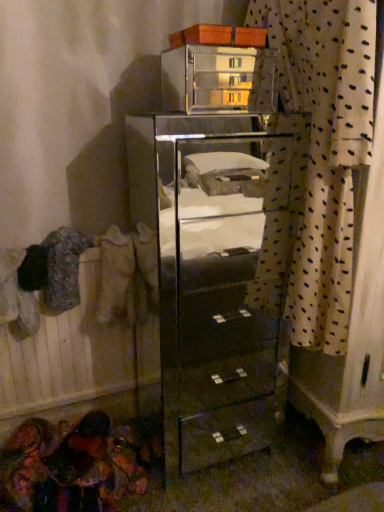
Question: Does white dotted fabric at right have a larger size compared to clear glass cabinet at center?

Choices:
 (A) yes
 (B) no

Answer: (B)

Question: Considering the relative sizes of white dotted fabric at right and clear glass cabinet at center in the image provided, is white dotted fabric at right smaller than clear glass cabinet at center?

Choices:
 (A) no
 (B) yes

Answer: (B)

Question: Can you confirm if white dotted fabric at right is thinner than clear glass cabinet at center?

Choices:
 (A) yes
 (B) no

Answer: (A)

Question: From a real-world perspective, is white dotted fabric at right on top of clear glass cabinet at center?

Choices:
 (A) no
 (B) yes

Answer: (B)

Question: Would you say white dotted fabric at right is a long distance from clear glass cabinet at center?

Choices:
 (A) yes
 (B) no

Answer: (B)

Question: Looking at their shapes, would you say beige fabric at left is wider or thinner than white dotted fabric at right?

Choices:
 (A) wide
 (B) thin

Answer: (A)

Question: In the image, is beige fabric at left positioned in front of or behind white dotted fabric at right?

Choices:
 (A) front
 (B) behind

Answer: (B)

Question: Do you think beige fabric at left is within white dotted fabric at right, or outside of it?

Choices:
 (A) outside
 (B) inside

Answer: (A)

Question: From their relative heights in the image, would you say beige fabric at left is taller or shorter than white dotted fabric at right?

Choices:
 (A) short
 (B) tall

Answer: (A)

Question: Looking at their shapes, would you say white dotted fabric at right is wider or thinner than beige fabric at left?

Choices:
 (A) thin
 (B) wide

Answer: (A)

Question: Does point (340, 173) appear closer or farther from the camera than point (109, 246)?

Choices:
 (A) farther
 (B) closer

Answer: (B)

Question: Considering the positions of white dotted fabric at right and beige fabric at left in the image, is white dotted fabric at right bigger or smaller than beige fabric at left?

Choices:
 (A) small
 (B) big

Answer: (B)

Question: From their relative heights in the image, would you say white dotted fabric at right is taller or shorter than beige fabric at left?

Choices:
 (A) short
 (B) tall

Answer: (B)

Question: In terms of size, does white dotted fabric at right appear bigger or smaller than clear glass cabinet at center?

Choices:
 (A) small
 (B) big

Answer: (A)

Question: Looking at their shapes, would you say white dotted fabric at right is wider or thinner than clear glass cabinet at center?

Choices:
 (A) thin
 (B) wide

Answer: (A)